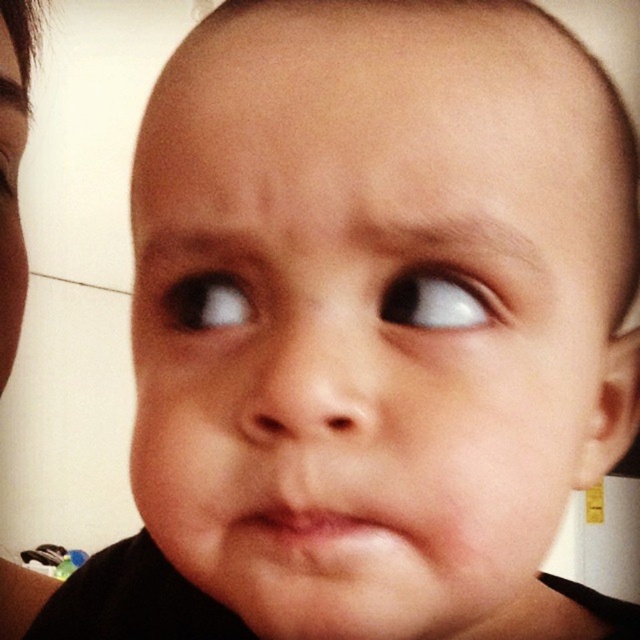
You are a photographer adjusting the focus of your camera. The baby is looking up, and you want to ensure the white glossy eye at upper right is in sharp focus. Based on the baby face orientation, where should you adjust the focus point to? Please provide coordinates in the format of x,y between 0 and 1.

Result: The white glossy eye at upper right is positioned at coordinates (435, 300), so you should adjust the focus point to (435, 300) to ensure it is in sharp focus.

Looking at the baby in the image, where is the white glossy eye at upper right in relation to the pink matte lips at center?

The white glossy eye at upper right is located to the right of the pink matte lips at center.

You are a photographer trying to capture a close up of the baby. You notice the white glossy eye at upper right and the brown glossy eye at upper center. Which eye should you focus on to ensure the other eye is in the background?

You should focus on the white glossy eye at upper right because it is in front of the brown glossy eye at upper center, so focusing on it will keep the brown glossy eye at upper center in the background.